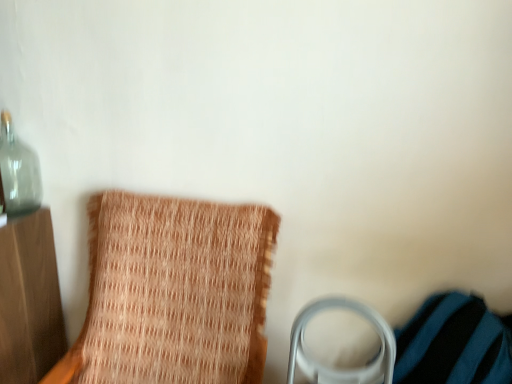
What do you see at coordinates (18, 172) in the screenshot? I see `transparent glass bottle at upper left` at bounding box center [18, 172].

Measure the distance between transparent glass bottle at upper left and camera.

5.20 feet.

In order to click on transparent glass bottle at upper left in this screenshot , I will do `click(18, 172)`.

You are a GUI agent. You are given a task and a screenshot of the screen. Output one action in this format:
    pyautogui.click(x=<x>, y=<y>)
    Task: Click on the woven fabric chair at left
    This screenshot has height=384, width=512.
    Given the screenshot: What is the action you would take?
    pyautogui.click(x=173, y=293)

From the picture: Measure the distance between point (218, 324) and camera.

They are 4.33 feet apart.

The width and height of the screenshot is (512, 384). What do you see at coordinates (173, 293) in the screenshot?
I see `woven fabric chair at left` at bounding box center [173, 293].

Find the location of `transparent glass bottle at upper left`. transparent glass bottle at upper left is located at coordinates (18, 172).

Which object is positioned more to the right, transparent glass bottle at upper left or woven fabric chair at left?

From the viewer's perspective, woven fabric chair at left appears more on the right side.

Is transparent glass bottle at upper left positioned before woven fabric chair at left?

No, transparent glass bottle at upper left is further to the viewer.

Considering the positions of points (10, 196) and (207, 355), is point (10, 196) closer to camera compared to point (207, 355)?

No, it is behind (207, 355).

From the image's perspective, which one is positioned lower, transparent glass bottle at upper left or woven fabric chair at left?

woven fabric chair at left.

From a real-world perspective, which object rests below the other?

woven fabric chair at left, from a real-world perspective.

Does transparent glass bottle at upper left have a lesser width compared to woven fabric chair at left?

Indeed, transparent glass bottle at upper left has a lesser width compared to woven fabric chair at left.

Is transparent glass bottle at upper left taller than woven fabric chair at left?

No, transparent glass bottle at upper left is not taller than woven fabric chair at left.

Which of these two, transparent glass bottle at upper left or woven fabric chair at left, is smaller?

transparent glass bottle at upper left.

Based on the photo, is woven fabric chair at left inside transparent glass bottle at upper left?

No, woven fabric chair at left is not surrounded by transparent glass bottle at upper left.

Would you say transparent glass bottle at upper left is a long distance from woven fabric chair at left?

That's not correct — transparent glass bottle at upper left is a little close to woven fabric chair at left.

Is transparent glass bottle at upper left oriented towards woven fabric chair at left?

No.

Find the location of `furniture in front of the transparent glass bottle at upper left`. furniture in front of the transparent glass bottle at upper left is located at coordinates (173, 293).

Which is more to the right, woven fabric chair at left or transparent glass bottle at upper left?

From the viewer's perspective, woven fabric chair at left appears more on the right side.

Which object is closer to the camera taking this photo, woven fabric chair at left or transparent glass bottle at upper left?

woven fabric chair at left is closer to the camera.

Which is less distant, (x=218, y=377) or (x=32, y=203)?

Point (x=218, y=377) appears to be closer to the viewer than point (x=32, y=203).

From the image's perspective, is woven fabric chair at left located above or below transparent glass bottle at upper left?

From the image's perspective, woven fabric chair at left appears below transparent glass bottle at upper left.

Looking at this image, from a real-world perspective, is woven fabric chair at left positioned above or below transparent glass bottle at upper left?

From a real-world perspective, woven fabric chair at left is physically below transparent glass bottle at upper left.

Is woven fabric chair at left thinner than transparent glass bottle at upper left?

Incorrect, the width of woven fabric chair at left is not less than that of transparent glass bottle at upper left.

Is woven fabric chair at left shorter than transparent glass bottle at upper left?

Incorrect, the height of woven fabric chair at left does not fall short of that of transparent glass bottle at upper left.

Between woven fabric chair at left and transparent glass bottle at upper left, which one has smaller size?

Smaller between the two is transparent glass bottle at upper left.

Consider the image. Does woven fabric chair at left contain transparent glass bottle at upper left?

No, transparent glass bottle at upper left is not surrounded by woven fabric chair at left.

Are woven fabric chair at left and transparent glass bottle at upper left located far from each other?

No, woven fabric chair at left is in close proximity to transparent glass bottle at upper left.

Is woven fabric chair at left positioned with its back to transparent glass bottle at upper left?

No, woven fabric chair at left's orientation is not away from transparent glass bottle at upper left.

In the scene shown: How different are the orientations of woven fabric chair at left and transparent glass bottle at upper left in degrees?

woven fabric chair at left and transparent glass bottle at upper left are facing 5.49 degrees away from each other.

Image resolution: width=512 pixels, height=384 pixels. Identify the location of furniture that appears below the transparent glass bottle at upper left (from a real-world perspective). (173, 293).

Where is `bottle located above the woven fabric chair at left (from the image's perspective)`? bottle located above the woven fabric chair at left (from the image's perspective) is located at coordinates (18, 172).

Where is `furniture in front of the transparent glass bottle at upper left`? The width and height of the screenshot is (512, 384). furniture in front of the transparent glass bottle at upper left is located at coordinates (173, 293).